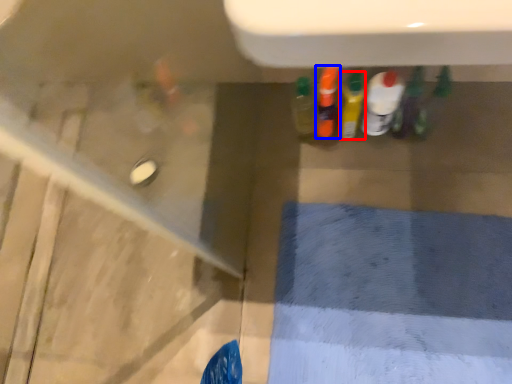
Question: Which object is closer to the camera taking this photo, bottle (highlighted by a red box) or bottle (highlighted by a blue box)?

Choices:
 (A) bottle
 (B) bottle

Answer: (A)